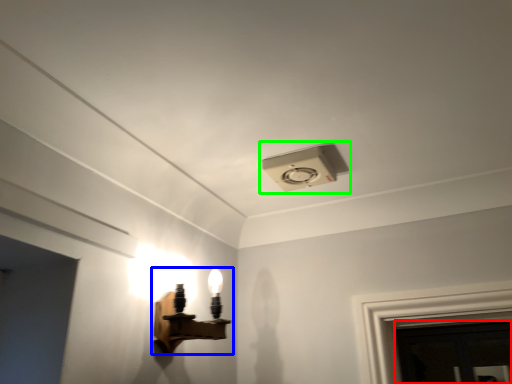
Question: Estimate the real-world distances between objects in this image. Which object is farther from door (highlighted by a red box), lamp (highlighted by a blue box) or lamp (highlighted by a green box)?

Choices:
 (A) lamp
 (B) lamp

Answer: (B)